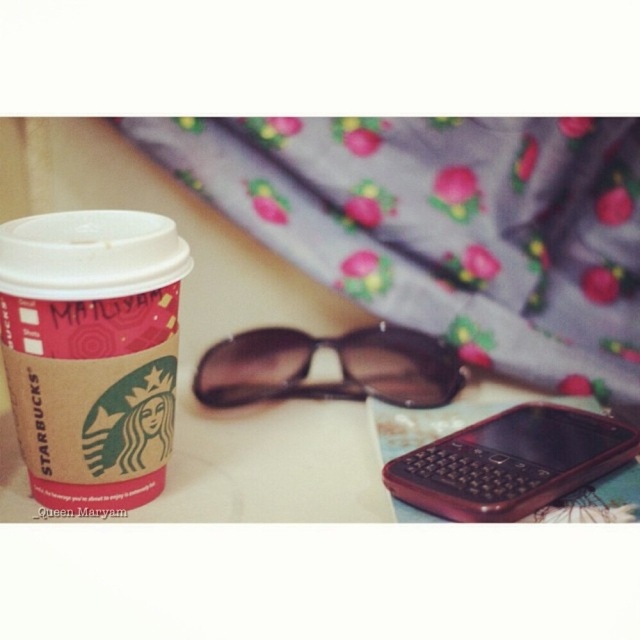
Is brown kraft paper cup at left above brown matte sunglasses at center?

Yes.

Can you confirm if brown kraft paper cup at left is bigger than brown matte sunglasses at center?

Yes, brown kraft paper cup at left is bigger than brown matte sunglasses at center.

Locate an element on the screen. The height and width of the screenshot is (640, 640). brown kraft paper cup at left is located at coordinates (92, 353).

Identify the location of brown kraft paper cup at left. This screenshot has height=640, width=640. (92, 353).

Does brown kraft paper cup at left appear under rubberized red phone at lower right?

Incorrect, brown kraft paper cup at left is not positioned below rubberized red phone at lower right.

Does brown kraft paper cup at left have a lesser width compared to rubberized red phone at lower right?

Indeed, brown kraft paper cup at left has a lesser width compared to rubberized red phone at lower right.

Find the location of a particular element. brown kraft paper cup at left is located at coordinates (92, 353).

I want to click on brown kraft paper cup at left, so click(x=92, y=353).

Which is more to the right, rubberized red phone at lower right or brown matte sunglasses at center?

rubberized red phone at lower right is more to the right.

Consider the image. Measure the distance from rubberized red phone at lower right to brown matte sunglasses at center.

7.10 inches

What do you see at coordinates (502, 461) in the screenshot?
I see `rubberized red phone at lower right` at bounding box center [502, 461].

Find the location of `rubberized red phone at lower right`. rubberized red phone at lower right is located at coordinates (502, 461).